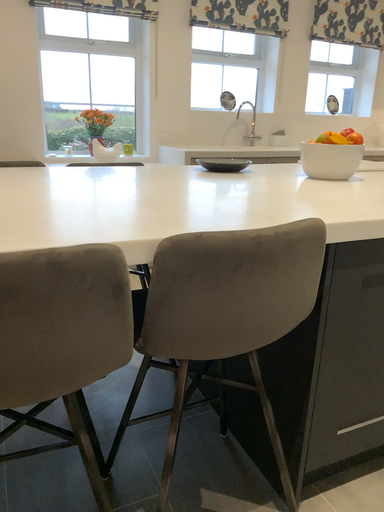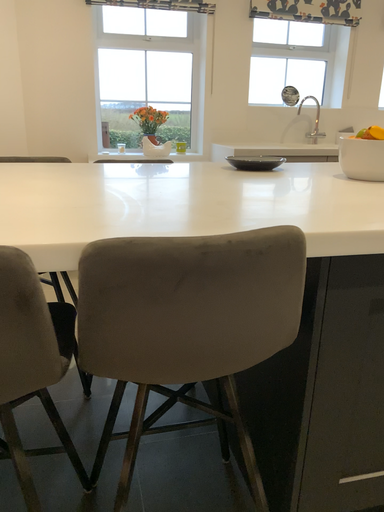
Question: Which way did the camera rotate in the video?

Choices:
 (A) rotated left
 (B) rotated right

Answer: (A)